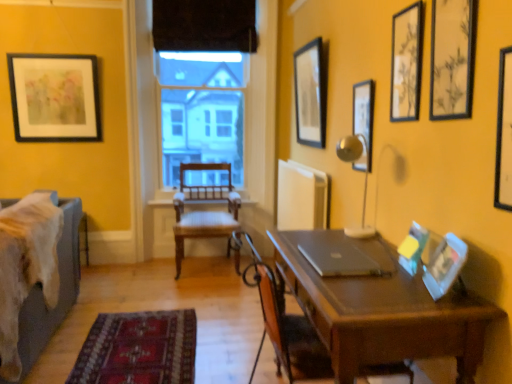
Question: Is matte black picture frame at upper right, the sixth picture frame when ordered from front to back, bigger than sleek silver laptop at center?

Choices:
 (A) no
 (B) yes

Answer: (B)

Question: Does matte black picture frame at upper right, which is the third picture frame in back-to-front order, have a lesser height compared to sleek silver laptop at center?

Choices:
 (A) yes
 (B) no

Answer: (B)

Question: Is matte black picture frame at upper right, which is the third picture frame in back-to-front order, outside of sleek silver laptop at center?

Choices:
 (A) yes
 (B) no

Answer: (A)

Question: Is sleek silver laptop at center completely or partially inside matte black picture frame at upper right, which is the third picture frame in back-to-front order?

Choices:
 (A) no
 (B) yes

Answer: (A)

Question: Is matte black picture frame at upper right, which appears as the 3th picture frame when viewed from the left, placed right next to sleek silver laptop at center?

Choices:
 (A) no
 (B) yes

Answer: (A)

Question: Can you confirm if matte black picture frame at upper right, positioned as the 6th picture frame in right-to-left order, is smaller than sleek silver laptop at center?

Choices:
 (A) yes
 (B) no

Answer: (B)

Question: From the image's perspective, is velvet blue bed at left beneath matte black picture frame at upper center, the second picture frame positioned from the back?

Choices:
 (A) no
 (B) yes

Answer: (B)

Question: From a real-world perspective, is velvet blue bed at left on matte black picture frame at upper center, acting as the 7th picture frame starting from the right?

Choices:
 (A) no
 (B) yes

Answer: (A)

Question: Considering the relative sizes of velvet blue bed at left and matte black picture frame at upper center, the second picture frame positioned from the back, in the image provided, is velvet blue bed at left taller than matte black picture frame at upper center, the second picture frame positioned from the back,?

Choices:
 (A) yes
 (B) no

Answer: (B)

Question: Considering the relative positions of velvet blue bed at left and matte black picture frame at upper center, the 7th picture frame when ordered from front to back, in the image provided, is velvet blue bed at left in front of matte black picture frame at upper center, the 7th picture frame when ordered from front to back,?

Choices:
 (A) no
 (B) yes

Answer: (B)

Question: Considering the relative positions of velvet blue bed at left and matte black picture frame at upper center, acting as the 7th picture frame starting from the right, in the image provided, is velvet blue bed at left to the right of matte black picture frame at upper center, acting as the 7th picture frame starting from the right, from the viewer's perspective?

Choices:
 (A) yes
 (B) no

Answer: (B)

Question: From a real-world perspective, is velvet blue bed at left located beneath matte black picture frame at upper center, the second picture frame positioned from the back?

Choices:
 (A) yes
 (B) no

Answer: (A)

Question: Is sleek silver laptop at center outside of matte black picture frame at upper right, which appears as the 3th picture frame when viewed from the left?

Choices:
 (A) yes
 (B) no

Answer: (A)